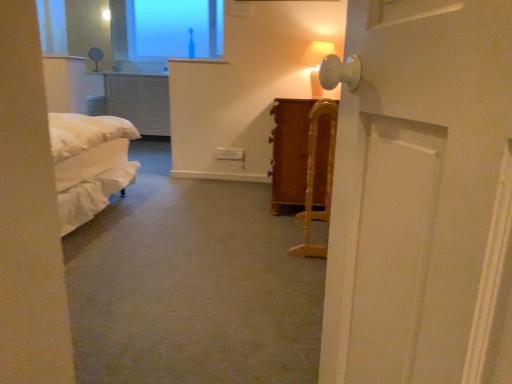
Question: From the image's perspective, is matte white table lamp at upper center, marked as the first table lamp in a top-to-bottom arrangement, over matte white table lamp at upper right, the first table lamp in the right-to-left sequence?

Choices:
 (A) yes
 (B) no

Answer: (A)

Question: Can you confirm if matte white table lamp at upper center, marked as the first table lamp in a top-to-bottom arrangement, is thinner than matte white table lamp at upper right, which appears as the 2th table lamp when viewed from the top?

Choices:
 (A) no
 (B) yes

Answer: (B)

Question: Is matte white table lamp at upper center, marked as the first table lamp in a top-to-bottom arrangement, turned away from matte white table lamp at upper right, placed as the first table lamp when sorted from front to back?

Choices:
 (A) yes
 (B) no

Answer: (B)

Question: Considering the relative sizes of matte white table lamp at upper center, the second table lamp viewed from the right, and matte white table lamp at upper right, which appears as the 2th table lamp when viewed from the top, in the image provided, is matte white table lamp at upper center, the second table lamp viewed from the right, shorter than matte white table lamp at upper right, which appears as the 2th table lamp when viewed from the top,?

Choices:
 (A) yes
 (B) no

Answer: (A)

Question: Would you say matte white table lamp at upper center, the second table lamp from the front, is a long distance from matte white table lamp at upper right, positioned as the 1th table lamp in bottom-to-top order?

Choices:
 (A) no
 (B) yes

Answer: (B)

Question: Does point (314, 69) appear closer or farther from the camera than point (209, 46)?

Choices:
 (A) farther
 (B) closer

Answer: (B)

Question: Which is correct: matte white table lamp at upper right, placed as the first table lamp when sorted from front to back, is inside transparent glass window at upper center, or outside of it?

Choices:
 (A) outside
 (B) inside

Answer: (A)

Question: Is matte white table lamp at upper right, the first table lamp in the right-to-left sequence, taller or shorter than transparent glass window at upper center?

Choices:
 (A) tall
 (B) short

Answer: (B)

Question: In terms of width, does matte white table lamp at upper right, which appears as the 2th table lamp when viewed from the top, look wider or thinner when compared to transparent glass window at upper center?

Choices:
 (A) wide
 (B) thin

Answer: (B)

Question: From a real-world perspective, is matte white table lamp at upper center, the second table lamp viewed from the right, above or below transparent glass window at upper center?

Choices:
 (A) above
 (B) below

Answer: (B)

Question: Which is correct: matte white table lamp at upper center, which ranks as the 1th table lamp in back-to-front order, is inside transparent glass window at upper center, or outside of it?

Choices:
 (A) outside
 (B) inside

Answer: (A)

Question: From the image's perspective, is matte white table lamp at upper center, marked as the first table lamp in a left-to-right arrangement, positioned above or below transparent glass window at upper center?

Choices:
 (A) below
 (B) above

Answer: (A)

Question: Looking at the image, does matte white table lamp at upper center, the second table lamp viewed from the right, seem bigger or smaller compared to transparent glass window at upper center?

Choices:
 (A) small
 (B) big

Answer: (A)

Question: From a real-world perspective, is wooden cane at center physically located above or below matte white table lamp at upper center, marked as the first table lamp in a left-to-right arrangement?

Choices:
 (A) above
 (B) below

Answer: (B)

Question: Considering the positions of point (317, 100) and point (90, 49), is point (317, 100) closer or farther from the camera than point (90, 49)?

Choices:
 (A) closer
 (B) farther

Answer: (A)